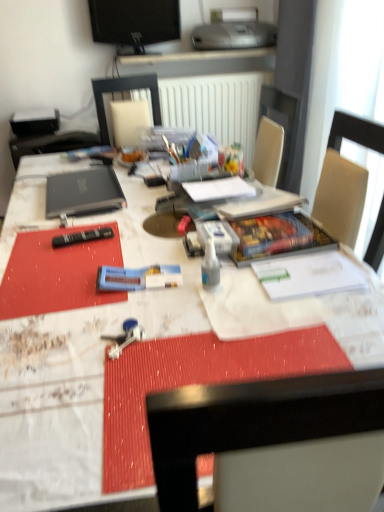
This screenshot has height=512, width=384. I want to click on vacant space behind blue plastic toothpaste tube at center, so click(x=143, y=251).